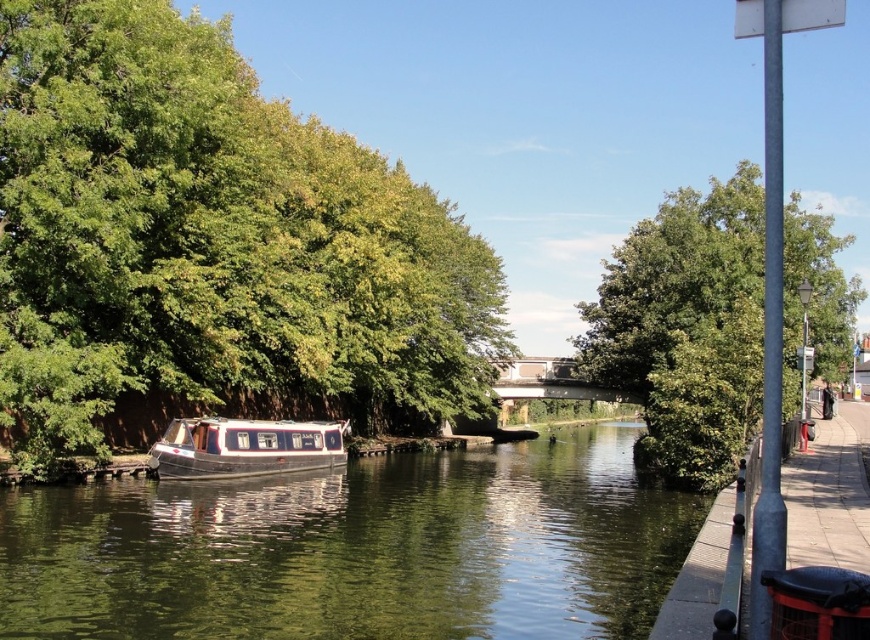
Question: Which point is farther from the camera taking this photo?

Choices:
 (A) (108, 333)
 (B) (206, 444)
 (C) (355, 570)

Answer: (B)

Question: Does green smooth water at center lie in front of white glossy boat at center?

Choices:
 (A) yes
 (B) no

Answer: (A)

Question: Does green leafy tree at left have a larger size compared to white glossy boat at center?

Choices:
 (A) yes
 (B) no

Answer: (A)

Question: Considering the real-world distances, which object is closest to the green leafy tree at upper center?

Choices:
 (A) green leafy tree at left
 (B) white glossy boat at center
 (C) green smooth water at center

Answer: (C)

Question: Among these objects, which one is nearest to the camera?

Choices:
 (A) white glossy boat at center
 (B) green leafy tree at upper center

Answer: (B)

Question: Is green smooth water at center thinner than white glossy boat at center?

Choices:
 (A) yes
 (B) no

Answer: (B)